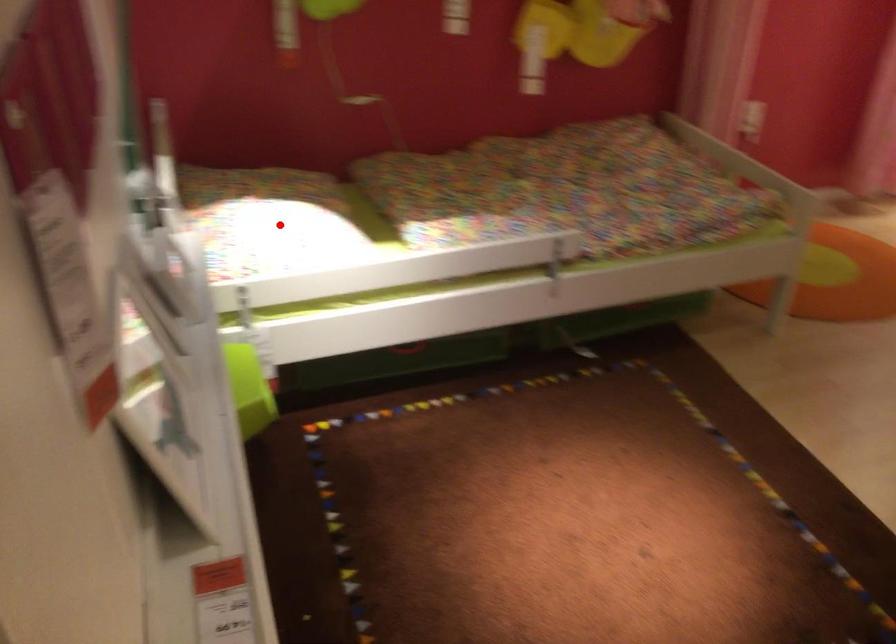
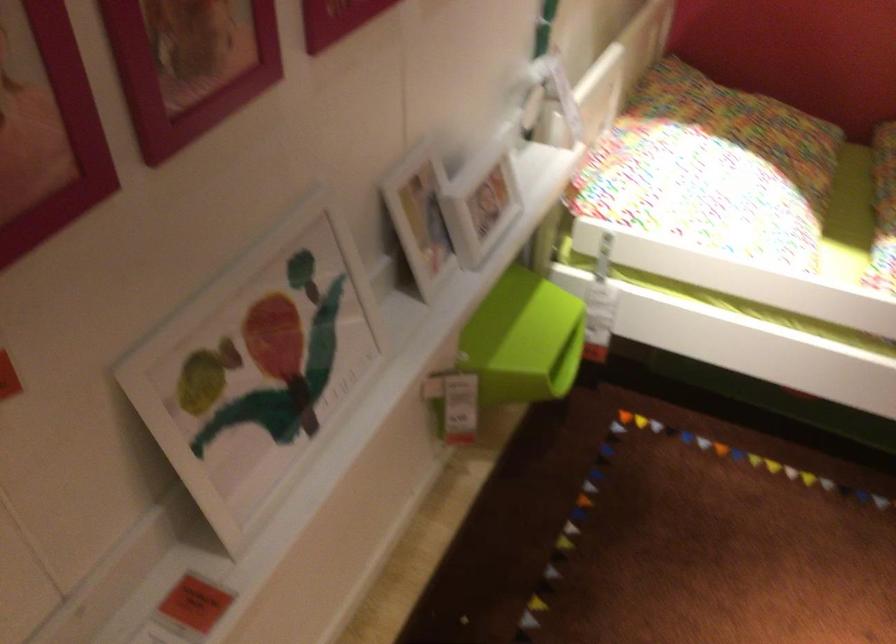
The point at the highlighted location is marked in the first image. Where is the corresponding point in the second image?

(712, 169)